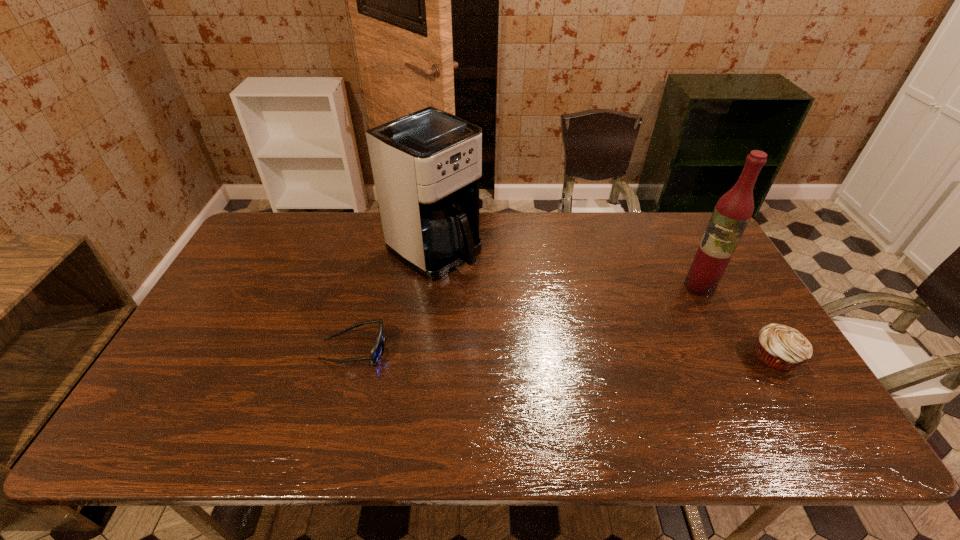
Locate an element on the screen. free area in between the liquor and the coffee maker is located at coordinates (567, 267).

Identify the location of unoccupied area between the shortest object and the muffin. (564, 353).

Identify which object is the second nearest to the coffee maker. Please provide its 2D coordinates. Your answer should be formatted as a tuple, i.e. [(x, y)], where the tuple contains the x and y coordinates of a point satisfying the conditions above.

[(732, 213)]

Select which object is the third closest to the coffee maker. Please provide its 2D coordinates. Your answer should be formatted as a tuple, i.e. [(x, y)], where the tuple contains the x and y coordinates of a point satisfying the conditions above.

[(782, 348)]

This screenshot has width=960, height=540. What are the coordinates of `free space that satisfies the following two spatial constraints: 1. on the front side of the muffin; 2. on the right side of the coffee maker` in the screenshot? It's located at (421, 357).